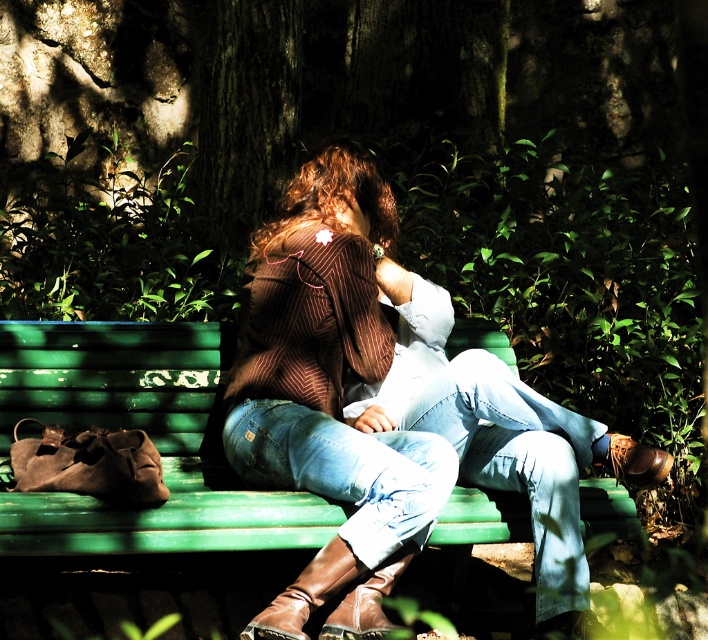
Question: Among these objects, which one is nearest to the camera?

Choices:
 (A) green painted wood bench at center
 (B) brown striped sweater at center

Answer: (B)

Question: Is brown striped sweater at center to the right of green painted wood bench at center from the viewer's perspective?

Choices:
 (A) no
 (B) yes

Answer: (B)

Question: Is brown striped sweater at center positioned before green painted wood bench at center?

Choices:
 (A) no
 (B) yes

Answer: (B)

Question: Is brown striped sweater at center bigger than green painted wood bench at center?

Choices:
 (A) no
 (B) yes

Answer: (B)